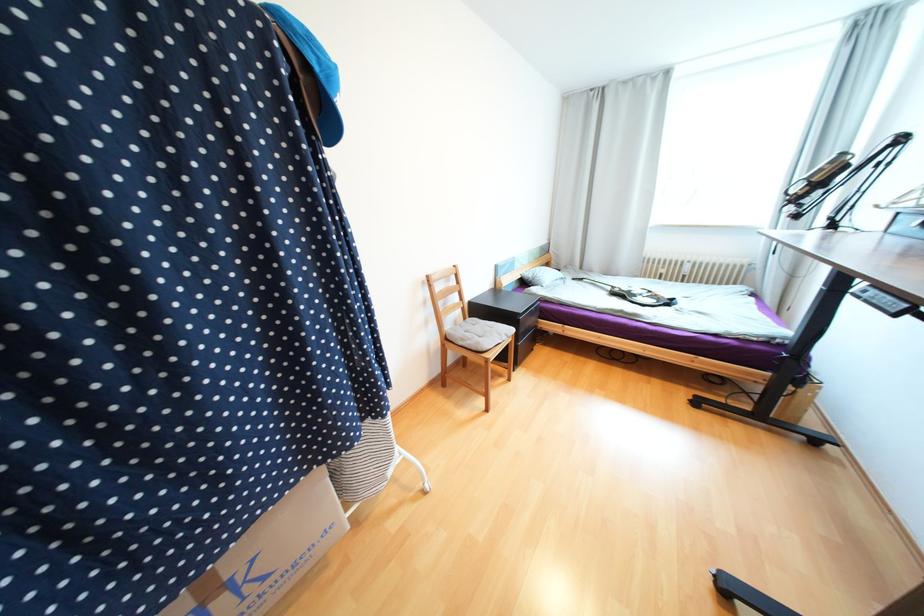
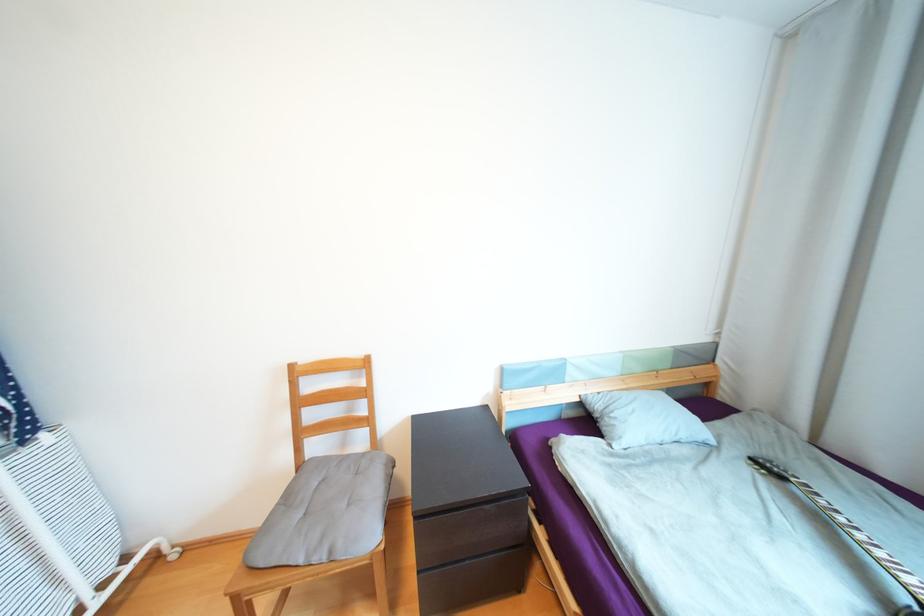
The point at (513, 334) is marked in the first image. Where is the corresponding point in the second image?

(335, 553)